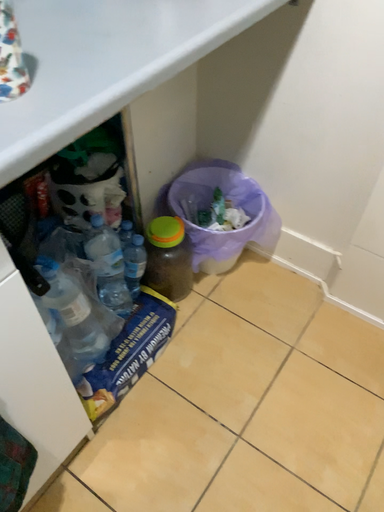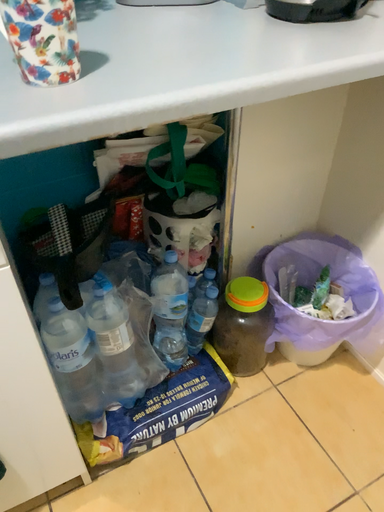
Question: Which way did the camera rotate in the video?

Choices:
 (A) rotated upward
 (B) rotated downward

Answer: (A)